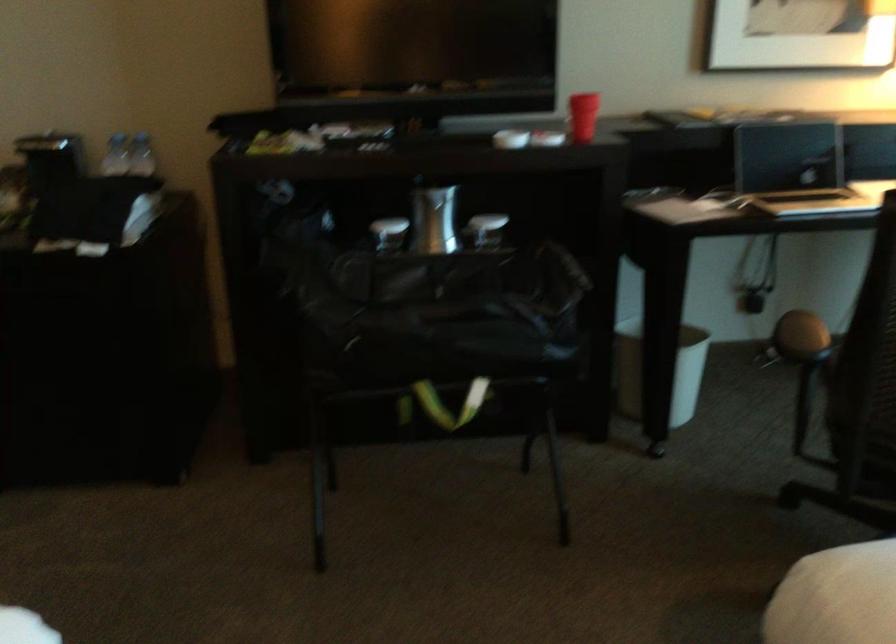
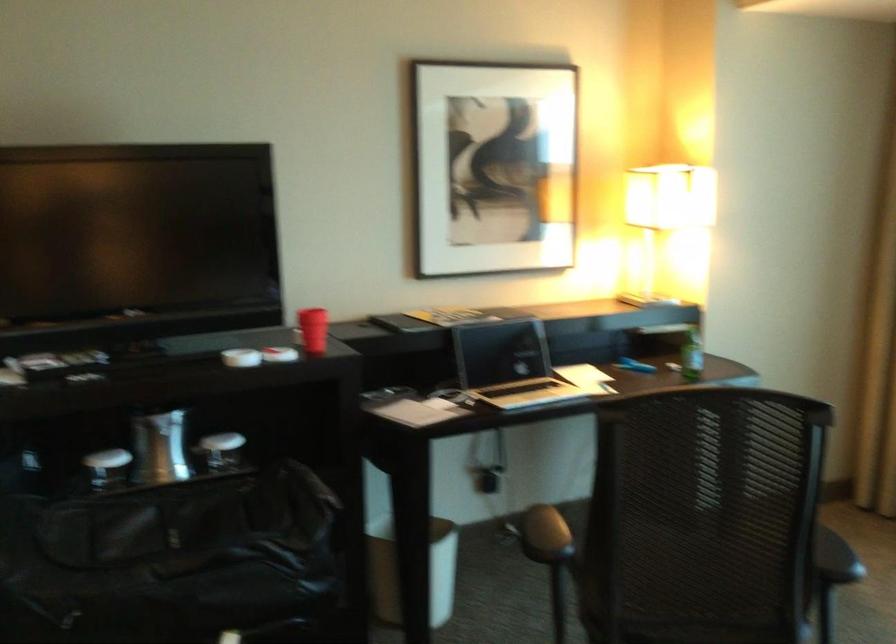
Question: Based on the continuous images, in which direction is the camera rotating? Reply with the corresponding letter.

Choices:
 (A) Left
 (B) Right
 (C) Up
 (D) Down

Answer: (B)